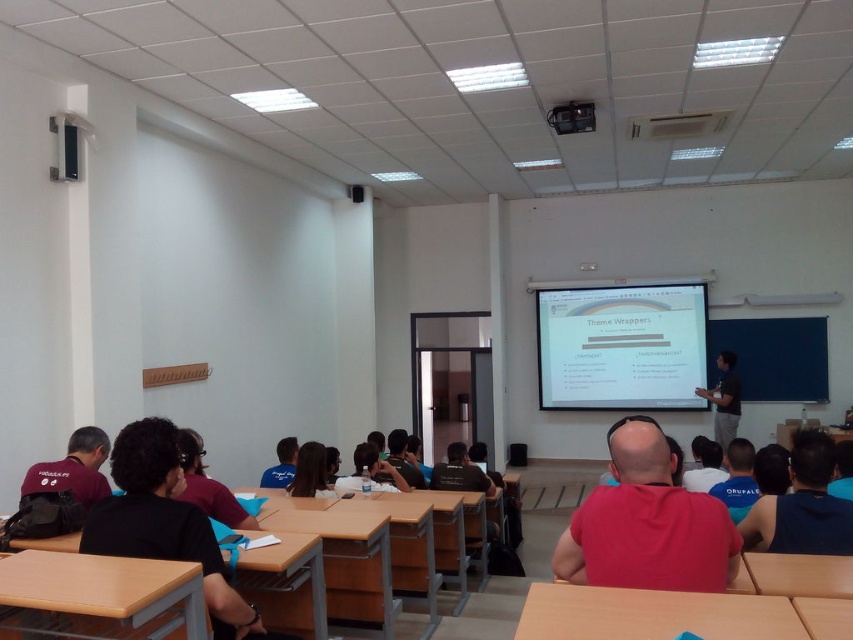
Question: Which object appears farthest from the camera in this image?

Choices:
 (A) wooden table at center
 (B) dark brown hair at center

Answer: (B)

Question: Among these objects, which one is farthest from the camera?

Choices:
 (A) matte black shirt at lower right
 (B) wooden table at lower left
 (C) matte black shirt at lower left

Answer: (C)

Question: Which of the following is the farthest from the observer?

Choices:
 (A) wooden table at lower right
 (B) wooden table at center

Answer: (A)

Question: Where is wooden desk at center located in relation to wooden table at center in the image?

Choices:
 (A) below
 (B) above

Answer: (A)

Question: Does matte black headphones at lower left lie in front of wooden table at center?

Choices:
 (A) yes
 (B) no

Answer: (B)

Question: Is matte black headphones at lower left to the left of black shirt at upper right from the viewer's perspective?

Choices:
 (A) yes
 (B) no

Answer: (A)